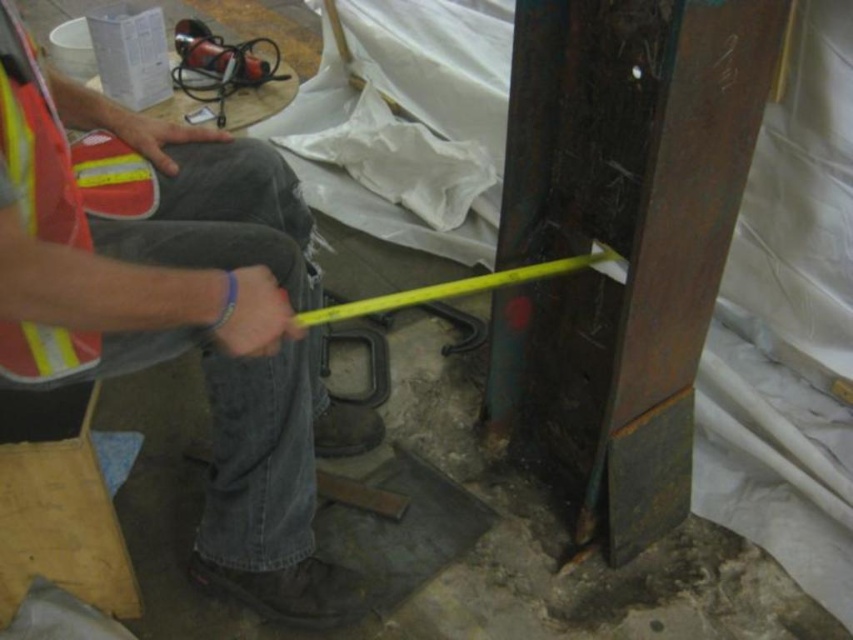
Find the location of a particular element. The image size is (853, 640). denim jeans at center is located at coordinates (178, 314).

Who is shorter, denim jeans at center or reflective fabric safety vest at left?

Standing shorter between the two is reflective fabric safety vest at left.

Does point (122, 362) lie behind point (47, 378)?

That is True.

Identify the location of denim jeans at center. (178, 314).